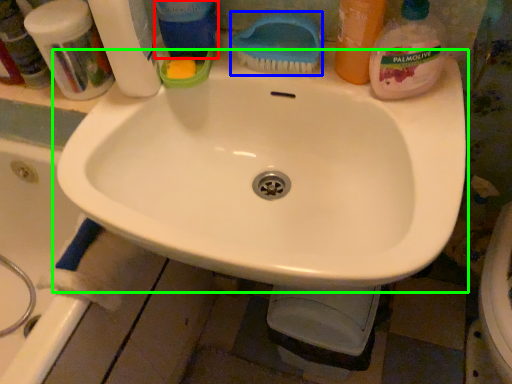
Question: Based on their relative distances, which object is farther from cleaning product (highlighted by a red box)? Choose from brush (highlighted by a blue box) and sink (highlighted by a green box).

Choices:
 (A) brush
 (B) sink

Answer: (B)